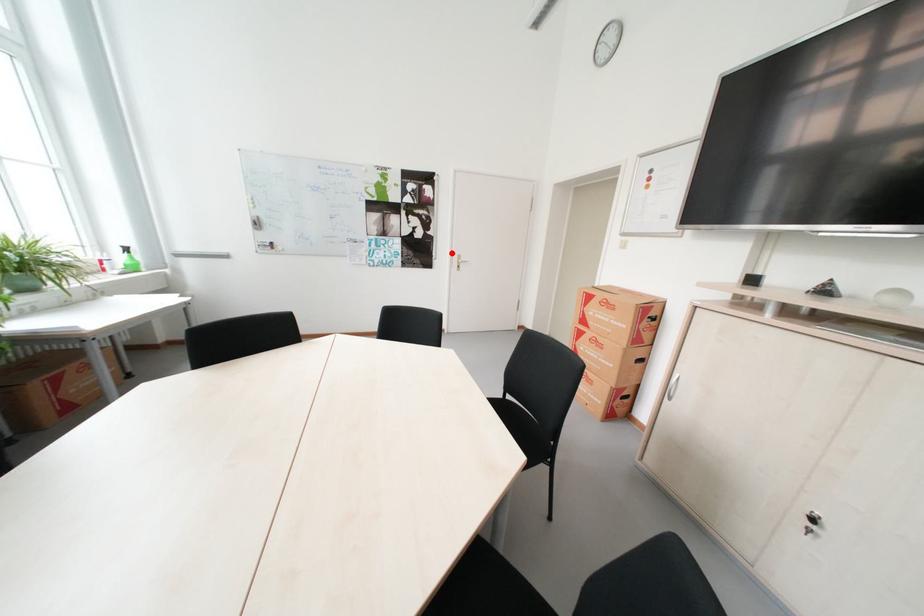
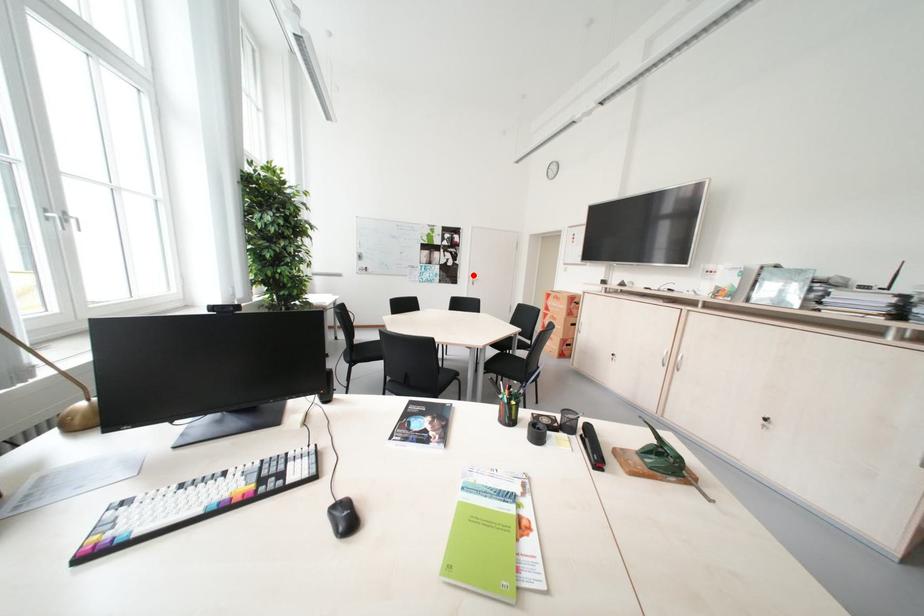
I am providing you with two images of the same scene from different viewpoints. A red point is marked on the first image and another point is marked on the second image. Is the marked point in image1 the same physical position as the marked point in image2?

Yes